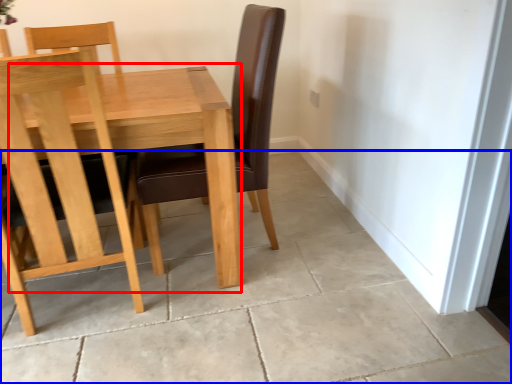
Question: Which of the following is the closest to the observer, table (highlighted by a red box) or concrete (highlighted by a blue box)?

Choices:
 (A) table
 (B) concrete

Answer: (B)